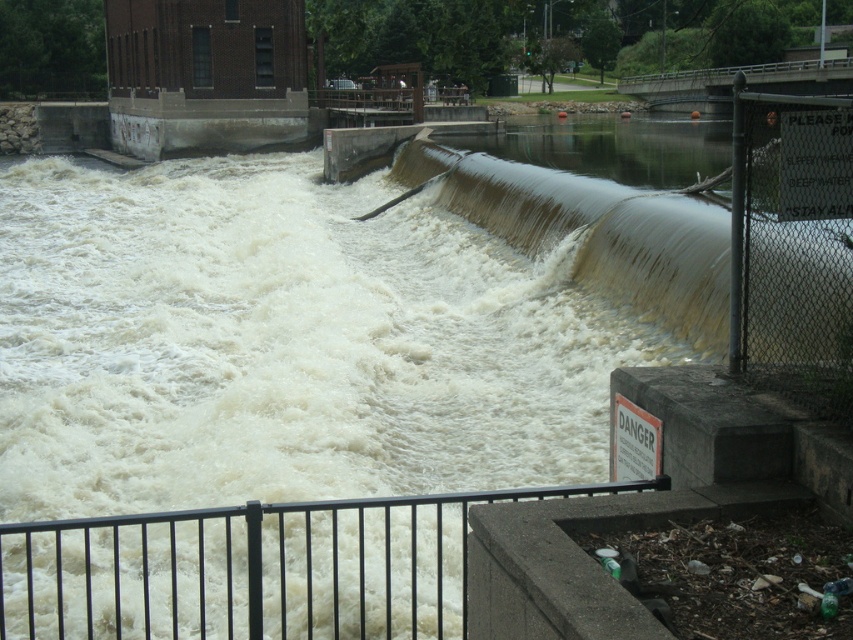
Question: Can you confirm if black metal fence at lower left is positioned below black chain-link fence at right?

Choices:
 (A) yes
 (B) no

Answer: (A)

Question: Does black metal fence at lower left lie behind black chain-link fence at right?

Choices:
 (A) yes
 (B) no

Answer: (B)

Question: Does black metal fence at lower left lie in front of black chain-link fence at right?

Choices:
 (A) yes
 (B) no

Answer: (A)

Question: Which point is closer to the camera?

Choices:
 (A) black metal fence at lower left
 (B) black chain-link fence at right

Answer: (A)

Question: Which of the following is the closest to the observer?

Choices:
 (A) (840, 104)
 (B) (393, 611)

Answer: (A)

Question: Among these objects, which one is farthest from the camera?

Choices:
 (A) black metal fence at lower left
 (B) black chain-link fence at right

Answer: (B)